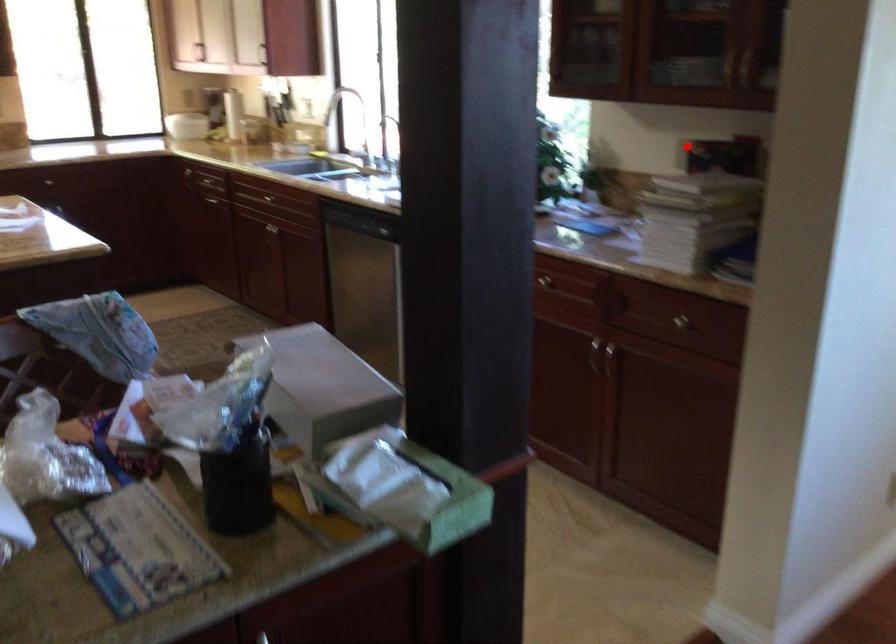
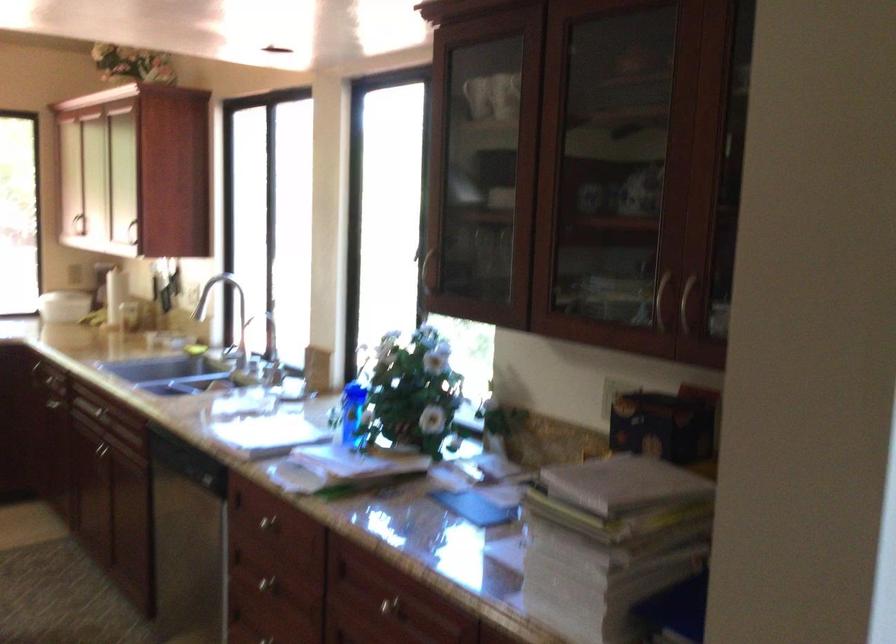
Question: I am providing you with two images of the same scene from different viewpoints. Image1 has a red point marked. In image2, the corresponding 3D location appears at what relative position? Reply with the corresponding letter.

Choices:
 (A) Closer
 (B) Farther

Answer: (A)